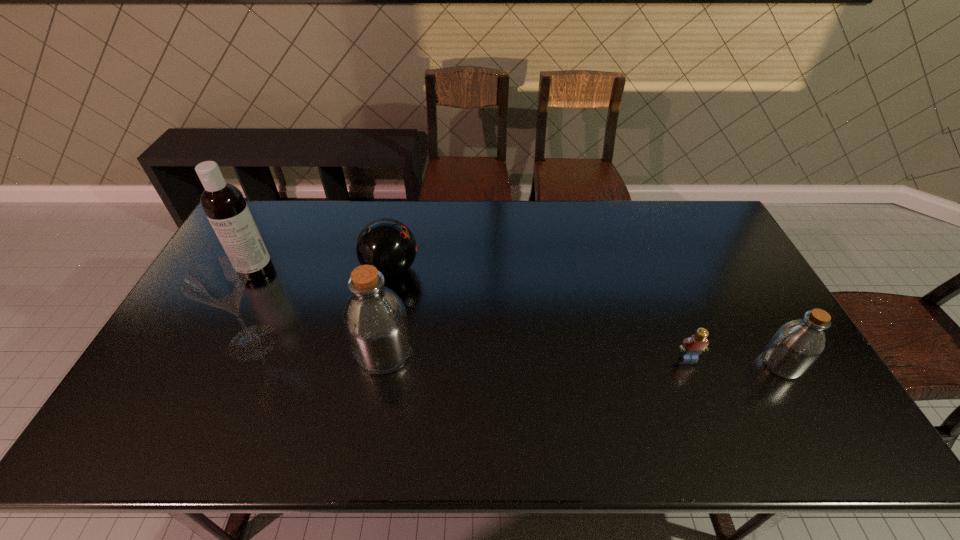
Image resolution: width=960 pixels, height=540 pixels. What are the coordinates of `vacant space that satisfies the following two spatial constraints: 1. on the front-facing side of the rightmost object; 2. on the left side of the second object from right to left` in the screenshot? It's located at (691, 363).